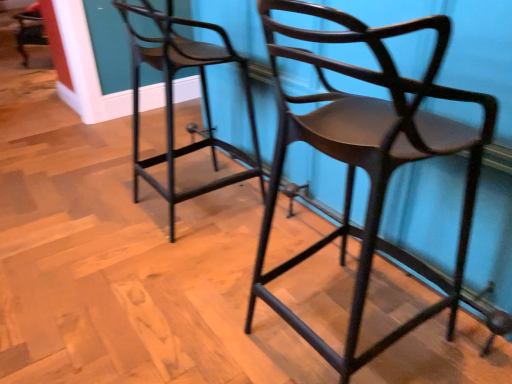
Question: Which direction should I rotate to look at matte dark wood chair at center, the 1th chair viewed from the right, — up or down?

Choices:
 (A) up
 (B) down

Answer: (B)

Question: From a real-world perspective, is matte black stool at center, the 2th chair positioned from the right, on matte dark wood chair at center, the 1th chair viewed from the right?

Choices:
 (A) no
 (B) yes

Answer: (A)

Question: Does matte black stool at center, positioned as the 1th chair in left-to-right order, have a smaller size compared to matte dark wood chair at center, the 1th chair viewed from the right?

Choices:
 (A) no
 (B) yes

Answer: (B)

Question: Is matte black stool at center, positioned as the 1th chair in left-to-right order, facing away from matte dark wood chair at center, the 1th chair viewed from the right?

Choices:
 (A) no
 (B) yes

Answer: (A)

Question: From the image's perspective, is matte black stool at center, positioned as the 1th chair in left-to-right order, below matte dark wood chair at center, the 1th chair viewed from the right?

Choices:
 (A) no
 (B) yes

Answer: (A)

Question: From the image's perspective, does matte black stool at center, positioned as the 1th chair in left-to-right order, appear higher than matte dark wood chair at center, which is counted as the second chair, starting from the left?

Choices:
 (A) yes
 (B) no

Answer: (A)

Question: Can matte dark wood chair at center, the 1th chair viewed from the right, be found inside matte black stool at center, the 2th chair positioned from the right?

Choices:
 (A) no
 (B) yes

Answer: (A)

Question: Can you confirm if matte dark wood chair at center, which is counted as the second chair, starting from the left, is wider than matte black stool at center, positioned as the 1th chair in left-to-right order?

Choices:
 (A) yes
 (B) no

Answer: (A)

Question: Can you confirm if matte dark wood chair at center, which is counted as the second chair, starting from the left, is positioned to the left of matte black stool at center, the 2th chair positioned from the right?

Choices:
 (A) yes
 (B) no

Answer: (B)

Question: Can you confirm if matte dark wood chair at center, which is counted as the second chair, starting from the left, is taller than matte black stool at center, positioned as the 1th chair in left-to-right order?

Choices:
 (A) yes
 (B) no

Answer: (A)

Question: Can you confirm if matte dark wood chair at center, which is counted as the second chair, starting from the left, is shorter than matte black stool at center, the 2th chair positioned from the right?

Choices:
 (A) yes
 (B) no

Answer: (B)

Question: From the image's perspective, is matte dark wood chair at center, the 1th chair viewed from the right, under matte black stool at center, positioned as the 1th chair in left-to-right order?

Choices:
 (A) yes
 (B) no

Answer: (A)

Question: Is matte dark wood chair at center, the 1th chair viewed from the right, next to matte black stool at center, positioned as the 1th chair in left-to-right order?

Choices:
 (A) no
 (B) yes

Answer: (A)

Question: From a real-world perspective, is matte dark wood chair at center, which is counted as the second chair, starting from the left, positioned above or below matte black stool at center, the 2th chair positioned from the right?

Choices:
 (A) above
 (B) below

Answer: (A)